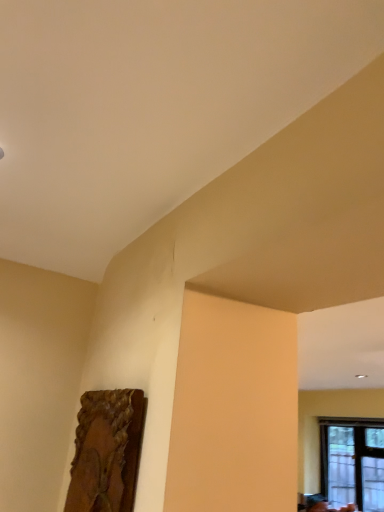
Question: Relative to wooden frame at lower left, is transparent glass window at lower right in front or behind?

Choices:
 (A) front
 (B) behind

Answer: (B)

Question: Based on their positions, is transparent glass window at lower right located to the left or right of wooden frame at lower left?

Choices:
 (A) right
 (B) left

Answer: (A)

Question: From a real-world perspective, relative to wooden frame at lower left, is transparent glass window at lower right vertically above or below?

Choices:
 (A) below
 (B) above

Answer: (A)

Question: Does point (129, 398) appear closer or farther from the camera than point (360, 449)?

Choices:
 (A) closer
 (B) farther

Answer: (A)

Question: Is wooden frame at lower left inside or outside of transparent glass window at lower right?

Choices:
 (A) inside
 (B) outside

Answer: (B)

Question: Based on their sizes in the image, would you say wooden frame at lower left is bigger or smaller than transparent glass window at lower right?

Choices:
 (A) big
 (B) small

Answer: (B)

Question: Based on their positions, is wooden frame at lower left located to the left or right of transparent glass window at lower right?

Choices:
 (A) right
 (B) left

Answer: (B)